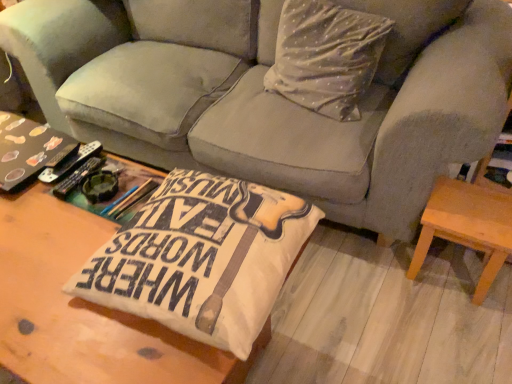
Describe the element at coordinates (326, 56) in the screenshot. I see `white dotted fabric pillow at upper center` at that location.

The width and height of the screenshot is (512, 384). I want to click on matte black book at left, so click(28, 149).

Where is `wooden coffee table at center, the 1th table from the left`? wooden coffee table at center, the 1th table from the left is located at coordinates (82, 309).

Between light brown wooden stool at lower right, arranged as the 1th table when viewed from the right, and white dotted fabric pillow at upper center, which one has smaller size?

Smaller between the two is light brown wooden stool at lower right, arranged as the 1th table when viewed from the right.

Which point is more distant from viewer, (441, 201) or (345, 82)?

The point (345, 82) is more distant.

Is light brown wooden stool at lower right, placed as the 2th table when sorted from left to right, completely or partially outside of white dotted fabric pillow at upper center?

light brown wooden stool at lower right, placed as the 2th table when sorted from left to right, is positioned outside white dotted fabric pillow at upper center.

From the picture: Is light brown wooden stool at lower right, arranged as the 1th table when viewed from the right, positioned behind white dotted fabric pillow at upper center?

No, light brown wooden stool at lower right, arranged as the 1th table when viewed from the right, is in front of white dotted fabric pillow at upper center.

Between matte black book at left and white dotted fabric pillow at upper center, which one has larger size?

white dotted fabric pillow at upper center is bigger.

Where is `book on the left side of white dotted fabric pillow at upper center`? book on the left side of white dotted fabric pillow at upper center is located at coordinates (28, 149).

Is matte black book at left positioned beyond the bounds of white dotted fabric pillow at upper center?

Result: Indeed, matte black book at left is completely outside white dotted fabric pillow at upper center.

Which is more to the right, matte black book at left or white dotted fabric pillow at upper center?

white dotted fabric pillow at upper center is more to the right.

Find the location of a particular element. studio couch located in front of the light brown wooden stool at lower right, which ranks as the 2th table in front-to-back order is located at coordinates (272, 95).

Is light brown wooden stool at lower right, which ranks as the 2th table in front-to-back order, not close to velvet gray couch at center?

Actually, light brown wooden stool at lower right, which ranks as the 2th table in front-to-back order, and velvet gray couch at center are a little close together.

Which of these two, light brown wooden stool at lower right, placed as the 2th table when sorted from left to right, or velvet gray couch at center, stands shorter?

Standing shorter between the two is light brown wooden stool at lower right, placed as the 2th table when sorted from left to right.

Between light brown wooden stool at lower right, which ranks as the 2th table in front-to-back order, and velvet gray couch at center, which one has smaller width?

light brown wooden stool at lower right, which ranks as the 2th table in front-to-back order, is thinner.

From the image's perspective, which one is positioned higher, matte black book at left or velvet gray couch at center?

velvet gray couch at center, from the image's perspective.

Where is `book behind the velvet gray couch at center`? The height and width of the screenshot is (384, 512). book behind the velvet gray couch at center is located at coordinates (28, 149).

Are matte black book at left and velvet gray couch at center far apart?

No, matte black book at left is not far from velvet gray couch at center.

From a real-world perspective, which object rests below the other?

In real-world perspective, velvet gray couch at center is lower.

Is velvet gray couch at center taller or shorter than light brown wooden stool at lower right, which ranks as the 2th table in front-to-back order?

In the image, velvet gray couch at center appears to be taller than light brown wooden stool at lower right, which ranks as the 2th table in front-to-back order.

Is velvet gray couch at center aimed at light brown wooden stool at lower right, which appears as the first table when viewed from the back?

No, velvet gray couch at center is not oriented towards light brown wooden stool at lower right, which appears as the first table when viewed from the back.

Is point (166, 78) positioned after point (490, 198)?

That is True.

From a real-world perspective, between velvet gray couch at center and light brown wooden stool at lower right, arranged as the 1th table when viewed from the right, who is vertically lower?

From a 3D spatial view, light brown wooden stool at lower right, arranged as the 1th table when viewed from the right, is below.

Considering the relative positions of matte black book at left and light brown wooden stool at lower right, placed as the 2th table when sorted from left to right, in the image provided, is matte black book at left in front of light brown wooden stool at lower right, placed as the 2th table when sorted from left to right,?

Yes, it is.

Find the location of a particular element. The width and height of the screenshot is (512, 384). table directly beneath the matte black book at left (from a real-world perspective) is located at coordinates (468, 226).

Is matte black book at left next to light brown wooden stool at lower right, placed as the 2th table when sorted from left to right, and touching it?

There is a gap between matte black book at left and light brown wooden stool at lower right, placed as the 2th table when sorted from left to right.

Is matte black book at left situated inside light brown wooden stool at lower right, which appears as the first table when viewed from the back, or outside?

matte black book at left is not inside light brown wooden stool at lower right, which appears as the first table when viewed from the back, it's outside.

Locate an element on the screen. The width and height of the screenshot is (512, 384). book above the velvet gray couch at center (from a real-world perspective) is located at coordinates (28, 149).

Who is bigger, velvet gray couch at center or matte black book at left?

With larger size is velvet gray couch at center.

Which object is thinner, velvet gray couch at center or matte black book at left?

With smaller width is matte black book at left.

Where is `table that appears below the white dotted fabric pillow at upper center (from a real-world perspective)`? table that appears below the white dotted fabric pillow at upper center (from a real-world perspective) is located at coordinates (468, 226).

Locate an element on the screen. throw pillow that is above the matte black book at left (from a real-world perspective) is located at coordinates (326, 56).

Based on the photo, when comparing their distances from velvet gray couch at center, does light brown wooden stool at lower right, which appears as the first table when viewed from the back, or matte black book at left seem closer?

Among the two, light brown wooden stool at lower right, which appears as the first table when viewed from the back, is located nearer to velvet gray couch at center.

When comparing their distances from light brown wooden stool at lower right, which appears as the first table when viewed from the back, does wooden coffee table at center, marked as the 1th table in a front-to-back arrangement, or matte black book at left seem closer?

wooden coffee table at center, marked as the 1th table in a front-to-back arrangement, is positioned closer to the anchor light brown wooden stool at lower right, which appears as the first table when viewed from the back.

Consider the image. Considering their positions, is white dotted fabric pillow at upper center positioned further to light brown wooden stool at lower right, which appears as the first table when viewed from the back, than matte black book at left?

matte black book at left is positioned further to the anchor light brown wooden stool at lower right, which appears as the first table when viewed from the back.

When comparing their distances from wooden coffee table at center, the second table positioned from the back, does matte black book at left or light brown wooden stool at lower right, arranged as the 1th table when viewed from the right, seem further?

light brown wooden stool at lower right, arranged as the 1th table when viewed from the right, lies further to wooden coffee table at center, the second table positioned from the back, than the other object.

Estimate the real-world distances between objects in this image. Which object is closer to matte black book at left, velvet gray couch at center or wooden coffee table at center, the second table positioned from the back?

wooden coffee table at center, the second table positioned from the back, is positioned closer to the anchor matte black book at left.

Which object lies nearer to the anchor point light brown wooden stool at lower right, arranged as the 1th table when viewed from the right, white dotted fabric pillow at upper center or velvet gray couch at center?

velvet gray couch at center is positioned closer to the anchor light brown wooden stool at lower right, arranged as the 1th table when viewed from the right.

Considering their positions, is velvet gray couch at center positioned further to white dotted fabric pillow at upper center than matte black book at left?

Among the two, matte black book at left is located further to white dotted fabric pillow at upper center.

When comparing their distances from velvet gray couch at center, does matte black book at left or light brown wooden stool at lower right, which ranks as the 2th table in front-to-back order, seem further?

The object further to velvet gray couch at center is matte black book at left.

This screenshot has height=384, width=512. I want to click on throw pillow situated between matte black book at left and light brown wooden stool at lower right, which appears as the first table when viewed from the back, from left to right, so click(326, 56).

This screenshot has width=512, height=384. I want to click on studio couch located between matte black book at left and white dotted fabric pillow at upper center in the left-right direction, so click(272, 95).

The image size is (512, 384). What are the coordinates of `throw pillow located between wooden coffee table at center, the 1th table from the left, and light brown wooden stool at lower right, which ranks as the 2th table in front-to-back order, in the left-right direction` in the screenshot? It's located at (326, 56).

You are a GUI agent. You are given a task and a screenshot of the screen. Output one action in this format:
    pyautogui.click(x=<x>, y=<y>)
    Task: Click on the table located between matte black book at left and white dotted fabric pillow at upper center in the left-right direction
    The image size is (512, 384).
    Given the screenshot: What is the action you would take?
    pyautogui.click(x=82, y=309)